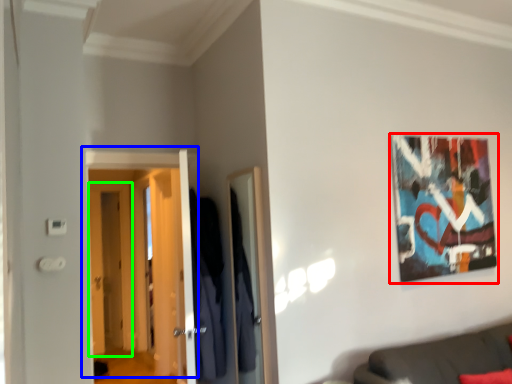
Question: Which object is the closest to the picture frame (highlighted by a red box)? Choose among these: door (highlighted by a blue box) or door (highlighted by a green box).

Choices:
 (A) door
 (B) door

Answer: (A)